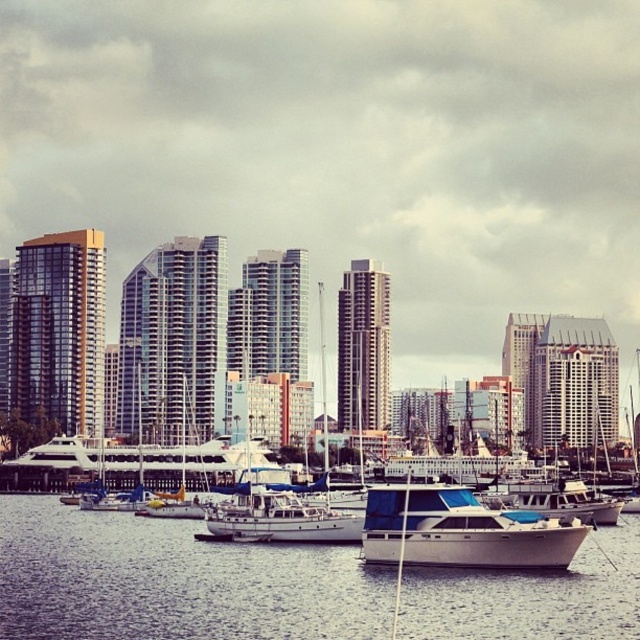
You are standing at the edge of the marina, looking out at the waterfront scene. There are two points marked in the image, one at coordinates point (456, 604) and another at point (163, 500). Which point do you perceive as being nearer to your viewpoint?

Point (456, 604) is closer to the camera than point (163, 500), so the point at (456, 604) appears nearer to your viewpoint.

You are a photographer planning to capture the waterfront scene. You want to ensure that the white glossy boat at center is framed within the white matte water at center. Based on their sizes, will the boat fit entirely within the water area in the image?

The white matte water at center has a larger width than the white glossy boat at center, so the boat will fit entirely within the water area.